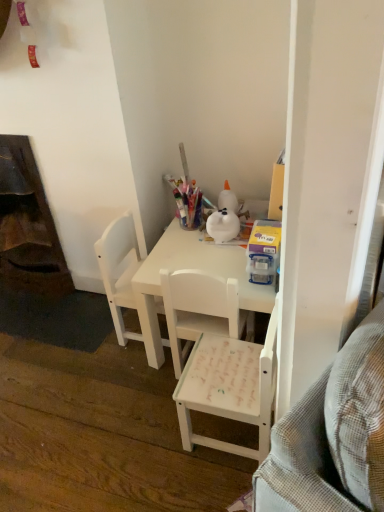
Locate an element on the screen. free spot in front of white matte chair at center, which is the 3th chair in left-to-right order is located at coordinates (209, 487).